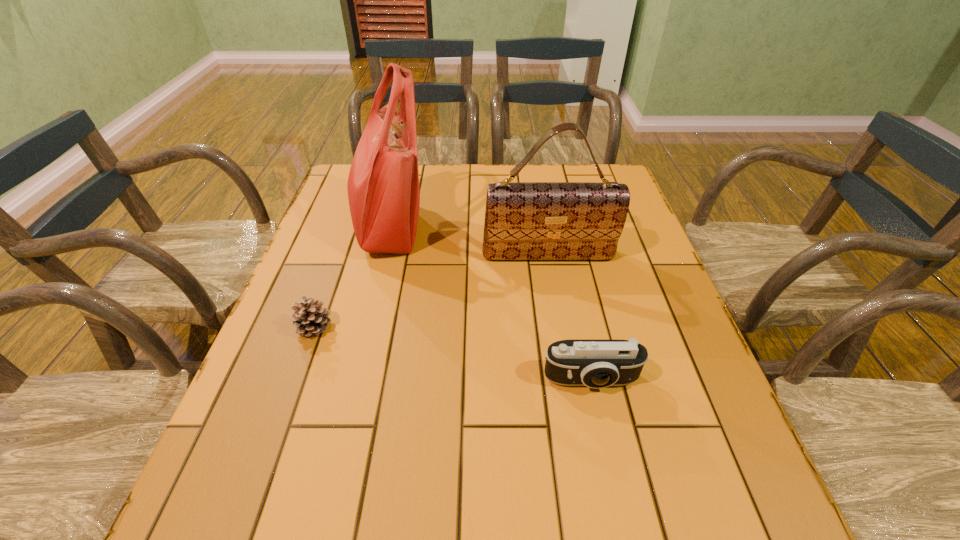
Find the location of a particular element. Image resolution: width=960 pixels, height=540 pixels. free spot between the shorter handbag and the shortest object is located at coordinates (432, 291).

This screenshot has width=960, height=540. What are the coordinates of `empty location between the pinecone and the right handbag` in the screenshot? It's located at (432, 291).

The width and height of the screenshot is (960, 540). In order to click on empty location between the taller handbag and the shorter handbag in this screenshot , I will do `click(468, 241)`.

This screenshot has width=960, height=540. I want to click on empty space that is in between the third farthest object and the nearest object, so click(x=453, y=354).

Identify which object is the second nearest to the third shortest object. Please provide its 2D coordinates. Your answer should be formatted as a tuple, i.e. [(x, y)], where the tuple contains the x and y coordinates of a point satisfying the conditions above.

[(597, 364)]

I want to click on object that stands as the second closest to the third tallest object, so click(383, 187).